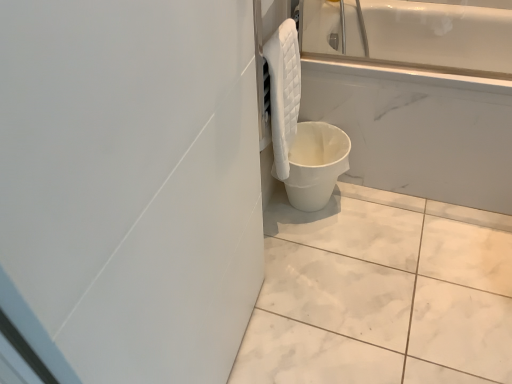
What do you see at coordinates (381, 293) in the screenshot? The height and width of the screenshot is (384, 512). I see `white marble tile at lower center` at bounding box center [381, 293].

Locate an element on the screen. The width and height of the screenshot is (512, 384). white marble tile at lower center is located at coordinates click(x=381, y=293).

From a real-world perspective, is white quilted towel at upper right on white marble tile at lower center?

Yes, from a real-world perspective, white quilted towel at upper right is above white marble tile at lower center.

Is the surface of white quilted towel at upper right in direct contact with white marble tile at lower center?

They are not placed beside each other.

Considering the sizes of objects white quilted towel at upper right and white marble tile at lower center in the image provided, who is bigger, white quilted towel at upper right or white marble tile at lower center?

Bigger between the two is white marble tile at lower center.

Consider the image. From the image's perspective, is white quilted towel at upper right above white marble tile at lower center?

Yes, from the image's perspective, white quilted towel at upper right is on top of white marble tile at lower center.

Is white matte bucket at lower right facing away from white quilted towel at upper right?

That's not correct — white matte bucket at lower right is not looking away from white quilted towel at upper right.

Between white matte bucket at lower right and white quilted towel at upper right, which one has smaller size?

Smaller between the two is white quilted towel at upper right.

Locate an element on the screen. This screenshot has width=512, height=384. toilet below the white quilted towel at upper right (from a real-world perspective) is located at coordinates (315, 164).

Are white matte bucket at lower right and white quilted towel at upper right far apart?

white matte bucket at lower right is actually quite close to white quilted towel at upper right.

Considering the relative sizes of white marble tile at lower center and white matte bucket at lower right in the image provided, is white marble tile at lower center smaller than white matte bucket at lower right?

Indeed, white marble tile at lower center has a smaller size compared to white matte bucket at lower right.

In the image, is white marble tile at lower center positioned in front of or behind white matte bucket at lower right?

Visually, white marble tile at lower center is located in front of white matte bucket at lower right.

From a real-world perspective, is white marble tile at lower center positioned over white matte bucket at lower right based on gravity?

No, from a real-world perspective, white marble tile at lower center is not over white matte bucket at lower right

From the picture: From the image's perspective, is white marble tile at lower center located above white matte bucket at lower right?

Incorrect, from the image's perspective, white marble tile at lower center is lower than white matte bucket at lower right.

From the picture: Between white matte bucket at lower right and white marble tile at lower center, which one appears on the right side from the viewer's perspective?

Positioned to the right is white marble tile at lower center.

Considering the sizes of white matte bucket at lower right and white marble tile at lower center in the image, is white matte bucket at lower right taller or shorter than white marble tile at lower center?

In the image, white matte bucket at lower right appears to be taller than white marble tile at lower center.

Which point is more forward, [307,192] or [447,316]?

The point [447,316] is closer.

Locate an element on the screen. Image resolution: width=512 pixels, height=384 pixels. ceramic tile in front of the white matte bucket at lower right is located at coordinates (381, 293).

Are white marble tile at lower center and white quilted towel at upper right far apart?

That's not correct — white marble tile at lower center is a little close to white quilted towel at upper right.

Looking at this image, does white marble tile at lower center have a smaller size compared to white quilted towel at upper right?

Actually, white marble tile at lower center might be larger than white quilted towel at upper right.

Is white marble tile at lower center surrounding white quilted towel at upper right?

No, white quilted towel at upper right is not a part of white marble tile at lower center.

Which is more to the right, white quilted towel at upper right or white matte bucket at lower right?

Positioned to the right is white matte bucket at lower right.

You are a GUI agent. You are given a task and a screenshot of the screen. Output one action in this format:
    pyautogui.click(x=<x>, y=<y>)
    Task: Click on the material in front of the white matte bucket at lower right
    This screenshot has height=384, width=512.
    Given the screenshot: What is the action you would take?
    pyautogui.click(x=283, y=92)

How distant is white quilted towel at upper right from white matte bucket at lower right?

A distance of 8.67 inches exists between white quilted towel at upper right and white matte bucket at lower right.

From a real-world perspective, who is located higher, white quilted towel at upper right or white matte bucket at lower right?

From a 3D spatial view, white quilted towel at upper right is above.

In order to click on material above the white marble tile at lower center (from a real-world perspective) in this screenshot , I will do `click(283, 92)`.

Find the location of `material in front of the white matte bucket at lower right`. material in front of the white matte bucket at lower right is located at coordinates (283, 92).

Which object lies nearer to the anchor point white marble tile at lower center, white quilted towel at upper right or white matte bucket at lower right?

Among the two, white matte bucket at lower right is located nearer to white marble tile at lower center.

When comparing their distances from white quilted towel at upper right, does white matte bucket at lower right or white marble tile at lower center seem further?

white marble tile at lower center lies further to white quilted towel at upper right than the other object.

Which object lies nearer to the anchor point white marble tile at lower center, white matte bucket at lower right or white quilted towel at upper right?

white matte bucket at lower right is positioned closer to the anchor white marble tile at lower center.

Estimate the real-world distances between objects in this image. Which object is closer to white quilted towel at upper right, white marble tile at lower center or white matte bucket at lower right?

white matte bucket at lower right is closer to white quilted towel at upper right.

When comparing their distances from white matte bucket at lower right, does white quilted towel at upper right or white marble tile at lower center seem further?

Based on the image, white marble tile at lower center appears to be further to white matte bucket at lower right.

From the image, which object appears to be farther from white matte bucket at lower right, white marble tile at lower center or white quilted towel at upper right?

white marble tile at lower center is further to white matte bucket at lower right.

Where is `toilet between white quilted towel at upper right and white marble tile at lower center vertically`? Image resolution: width=512 pixels, height=384 pixels. toilet between white quilted towel at upper right and white marble tile at lower center vertically is located at coordinates (315, 164).